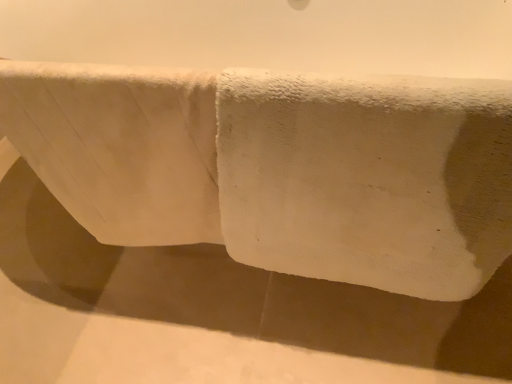
The height and width of the screenshot is (384, 512). I want to click on white soft towel at center, so click(x=279, y=168).

The image size is (512, 384). What do you see at coordinates (279, 168) in the screenshot?
I see `white soft towel at center` at bounding box center [279, 168].

The width and height of the screenshot is (512, 384). I want to click on white fluffy towel at upper center, so click(x=119, y=147).

Describe the element at coordinates (119, 147) in the screenshot. I see `white fluffy towel at upper center` at that location.

You are a GUI agent. You are given a task and a screenshot of the screen. Output one action in this format:
    pyautogui.click(x=<x>, y=<y>)
    Task: Click on the white soft towel at center
    This screenshot has height=384, width=512.
    Given the screenshot: What is the action you would take?
    pyautogui.click(x=279, y=168)

Is white fluffy towel at upper center to the left of white soft towel at center from the viewer's perspective?

Correct, you'll find white fluffy towel at upper center to the left of white soft towel at center.

Is white fluffy towel at upper center in front of white soft towel at center?

No, it is behind white soft towel at center.

Does point (121, 215) come closer to viewer compared to point (283, 271)?

Yes.

From the image's perspective, which is below, white fluffy towel at upper center or white soft towel at center?

white fluffy towel at upper center.

From a real-world perspective, who is located higher, white fluffy towel at upper center or white soft towel at center?

white fluffy towel at upper center, from a real-world perspective.

Looking at their sizes, would you say white fluffy towel at upper center is wider or thinner than white soft towel at center?

Clearly, white fluffy towel at upper center has less width compared to white soft towel at center.

Between white fluffy towel at upper center and white soft towel at center, which one has more height?

With more height is white soft towel at center.

Can you confirm if white fluffy towel at upper center is bigger than white soft towel at center?

Incorrect, white fluffy towel at upper center is not larger than white soft towel at center.

Would you say white soft towel at center is part of white fluffy towel at upper center's contents?

No, white fluffy towel at upper center does not contain white soft towel at center.

Is the surface of white fluffy towel at upper center in direct contact with white soft towel at center?

Yes, white fluffy towel at upper center is in contact with white soft towel at center.

Is white fluffy towel at upper center turned away from white soft towel at center?

That's right, white fluffy towel at upper center is facing away from white soft towel at center.

Consider the image. How different are the orientations of white fluffy towel at upper center and white soft towel at center in degrees?

white fluffy towel at upper center and white soft towel at center are facing 0.00148 degrees away from each other.

Measure the distance between white fluffy towel at upper center and white soft towel at center.

white fluffy towel at upper center and white soft towel at center are 3.03 inches apart.

At what (x,y) coordinates should I click in order to perform the action: click on towel in front of the white fluffy towel at upper center. Please return your answer as a coordinate pair (x, y). The width and height of the screenshot is (512, 384). Looking at the image, I should click on (279, 168).

Considering the relative positions of white soft towel at center and white fluffy towel at upper center in the image provided, is white soft towel at center to the right of white fluffy towel at upper center from the viewer's perspective?

Indeed, white soft towel at center is positioned on the right side of white fluffy towel at upper center.

Between white soft towel at center and white fluffy towel at upper center, which one is positioned behind?

white fluffy towel at upper center is more distant.

Which is closer to the camera, (228, 226) or (188, 220)?

Clearly, point (228, 226) is closer to the camera than point (188, 220).

From the image's perspective, between white soft towel at center and white fluffy towel at upper center, who is located below?

white fluffy towel at upper center appears lower in the image.

From a real-world perspective, is white soft towel at center on white fluffy towel at upper center?

Incorrect, from a real-world perspective, white soft towel at center is lower than white fluffy towel at upper center.

Looking at their sizes, would you say white soft towel at center is wider or thinner than white fluffy towel at upper center?

In the image, white soft towel at center appears to be wider than white fluffy towel at upper center.

Considering the sizes of objects white soft towel at center and white fluffy towel at upper center in the image provided, who is shorter, white soft towel at center or white fluffy towel at upper center?

white fluffy towel at upper center is shorter.

Can you confirm if white soft towel at center is bigger than white fluffy towel at upper center?

Indeed, white soft towel at center has a larger size compared to white fluffy towel at upper center.

Is white soft towel at center positioned beyond the bounds of white fluffy towel at upper center?

white soft towel at center is positioned outside white fluffy towel at upper center.

Based on the photo, is white soft towel at center far away from white fluffy towel at upper center?

white soft towel at center is actually quite close to white fluffy towel at upper center.

Is white soft towel at center turned away from white fluffy towel at upper center?

That's right, white soft towel at center is facing away from white fluffy towel at upper center.

Identify the location of bath towel below the white soft towel at center (from the image's perspective). The image size is (512, 384). (119, 147).

Find the location of a particular element. Image resolution: width=512 pixels, height=384 pixels. bath towel on the left of the white soft towel at center is located at coordinates (119, 147).

You are a GUI agent. You are given a task and a screenshot of the screen. Output one action in this format:
    pyautogui.click(x=<x>, y=<y>)
    Task: Click on the towel directly beneath the white fluffy towel at upper center (from a real-world perspective)
    Image resolution: width=512 pixels, height=384 pixels.
    Given the screenshot: What is the action you would take?
    pyautogui.click(x=279, y=168)